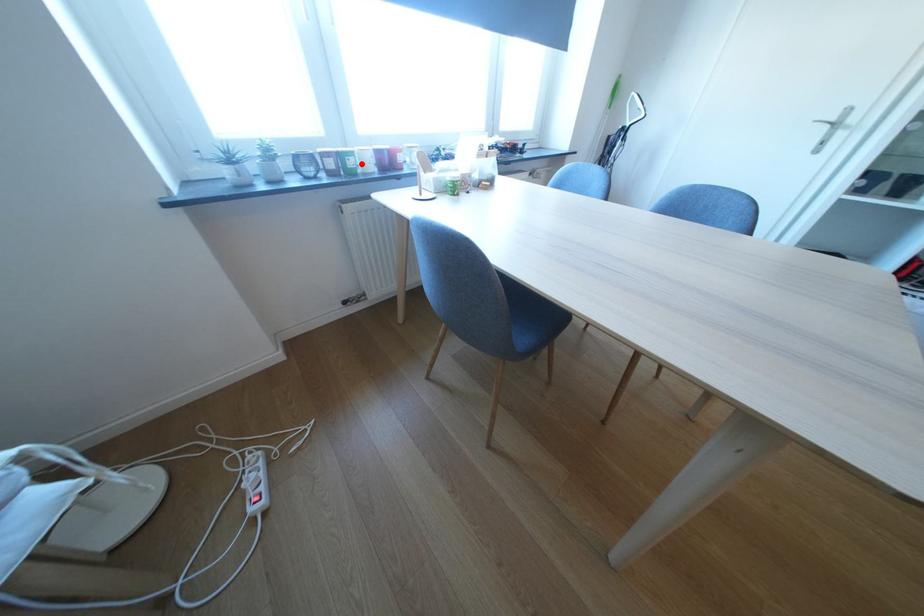
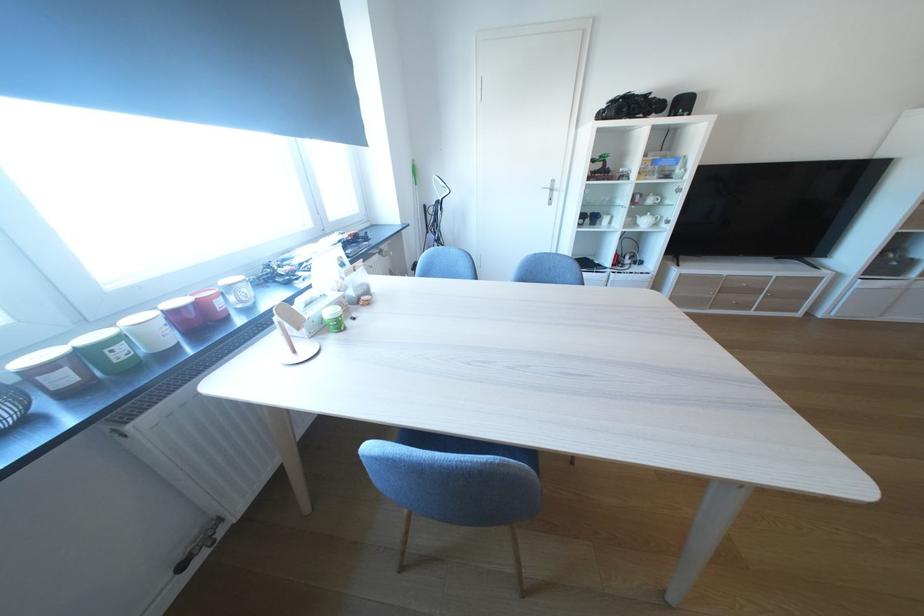
The point at the highlighted location is marked in the first image. Where is the corresponding point in the second image?

(129, 354)